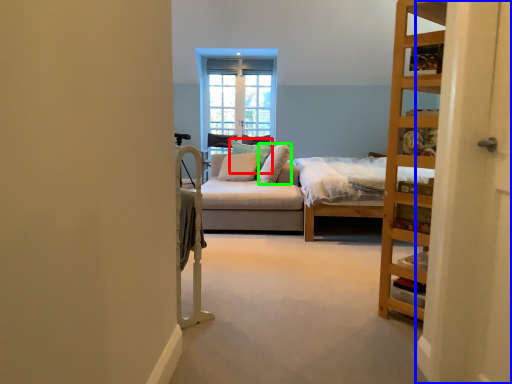
Question: Considering the real-world distances, which object is farthest from pillow (highlighted by a red box)? screen door (highlighted by a blue box) or pillow (highlighted by a green box)?

Choices:
 (A) screen door
 (B) pillow

Answer: (A)